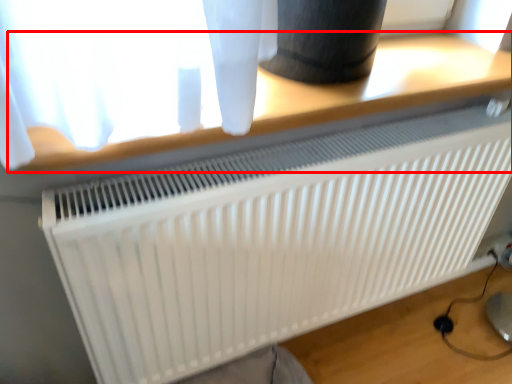
Question: In this image, where is table (annotated by the red box) located relative to radiator?

Choices:
 (A) right
 (B) left

Answer: (B)